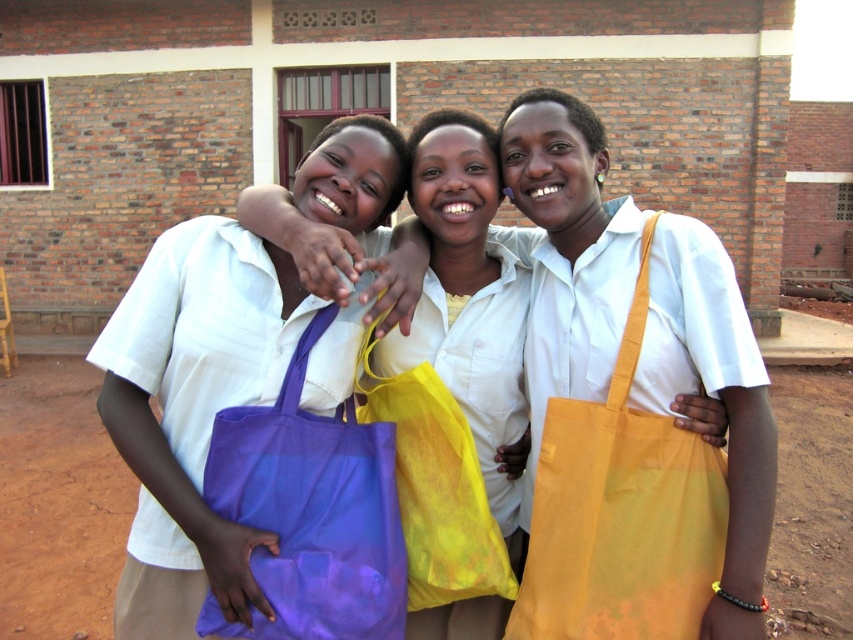
You are a photographer trying to capture both the matte purple tote bag at left and the yellow fabric tote at right in a single shot. Since you want to ensure both are clearly visible, which bag should you focus on first to maintain depth of field?

The matte purple tote bag at left is in front of the yellow fabric tote at right. To maintain depth of field, focus on the matte purple tote bag at left first since it is closer to the camera.

You are a photographer trying to capture a photo of the matte purple tote bag at left and the yellow fabric tote at right. Which bag should you focus on first if you want to capture them from left to right in the frame?

You should focus on the matte purple tote bag at left first because it is positioned on the left side of the yellow fabric tote at right.

You are a delivery person who needs to place the matte purple tote bag at left and the yellow fabric tote at right into a storage bin. The bin can only hold items that are narrower than 30 cm. Based on the scene, can you determine if both items will fit?

The matte purple tote bag at left might be wider than yellow fabric tote at right. Since the bin can only hold items narrower than 30 cm, we cannot confirm if both will fit without knowing the exact width of the matte purple tote bag at left. If it exceeds 30 cm, it won